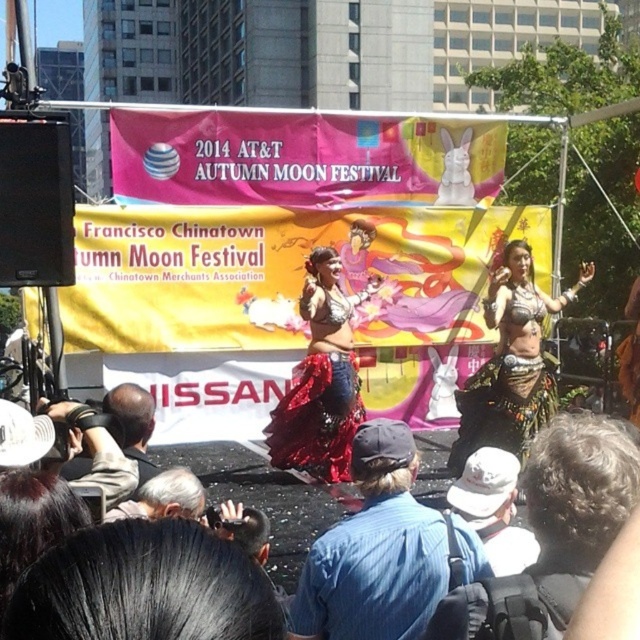
Can you confirm if khaki cotton shirt at lower left is positioned to the right of gray hair at lower left?

In fact, khaki cotton shirt at lower left is to the left of gray hair at lower left.

Is point (113, 506) farther from viewer compared to point (145, 500)?

No, it is not.

This screenshot has width=640, height=640. I want to click on khaki cotton shirt at lower left, so click(93, 451).

Can you confirm if denim jacket at lower right is positioned below shiny red fabric at center?

Yes.

Which of these two, denim jacket at lower right or shiny red fabric at center, stands taller?

With more height is shiny red fabric at center.

Between point (550, 461) and point (353, 397), which one is positioned behind?

The point (353, 397) is behind.

The image size is (640, 640). In order to click on denim jacket at lower right in this screenshot , I will do `click(556, 529)`.

From the picture: Can you confirm if shiny red fabric at center is positioned above gray hair at lower left?

Indeed, shiny red fabric at center is positioned over gray hair at lower left.

Which is behind, point (336, 461) or point (161, 480)?

The point (336, 461) is behind.

Is point (305, 468) more distant than point (160, 508)?

Yes, point (305, 468) is behind point (160, 508).

Identify the location of shiny red fabric at center. The width and height of the screenshot is (640, 640). (321, 380).